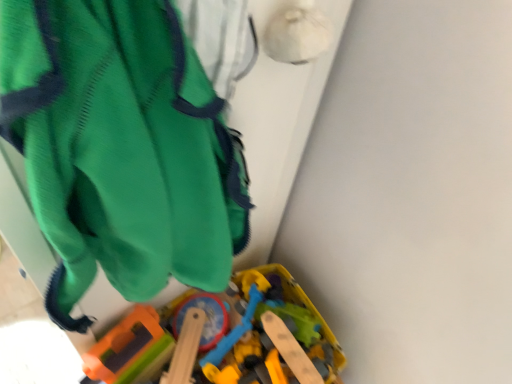
Question: Is green fabric backpack at upper left taller or shorter than wooden toy train at lower center?

Choices:
 (A) short
 (B) tall

Answer: (B)

Question: From a real-world perspective, is green fabric backpack at upper left above or below wooden toy train at lower center?

Choices:
 (A) above
 (B) below

Answer: (A)

Question: From the image's perspective, is green fabric backpack at upper left located above or below wooden toy train at lower center?

Choices:
 (A) below
 (B) above

Answer: (B)

Question: From the image's perspective, is wooden toy train at lower center above or below green fabric backpack at upper left?

Choices:
 (A) below
 (B) above

Answer: (A)

Question: Visually, is wooden toy train at lower center positioned to the left or to the right of green fabric backpack at upper left?

Choices:
 (A) left
 (B) right

Answer: (B)

Question: Looking at the image, does wooden toy train at lower center seem bigger or smaller compared to green fabric backpack at upper left?

Choices:
 (A) small
 (B) big

Answer: (B)

Question: From a real-world perspective, relative to green fabric backpack at upper left, is wooden toy train at lower center vertically above or below?

Choices:
 (A) above
 (B) below

Answer: (B)